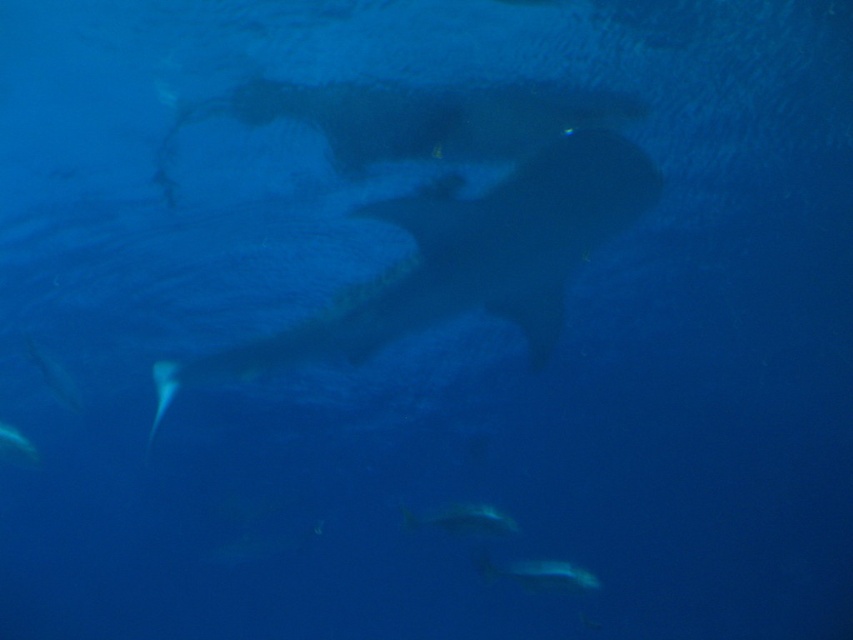
You are a marine biologist observing underwater life. You notice the translucent blue fish at lower center and the shiny silver fish at center. Which fish is closer to you?

The translucent blue fish at lower center is closer to you than the shiny silver fish at center.

You are a marine biologist studying underwater life. You observe a translucent blue fish at lower center in the image. What are the coordinates of this fish in the image?

The coordinates of the translucent blue fish at lower center are at point (x=541, y=573).

You are a marine biologist diving at a depth of 15 meters. You see a translucent blue fish at lower center. If your camera is 4.89 meters away from the fish, can you capture it in your photo without moving closer? Please explain.

The translucent blue fish at lower center is 4.89 meters away from the camera. Since the camera is already positioned at that distance, you can capture the fish in your photo without moving closer.